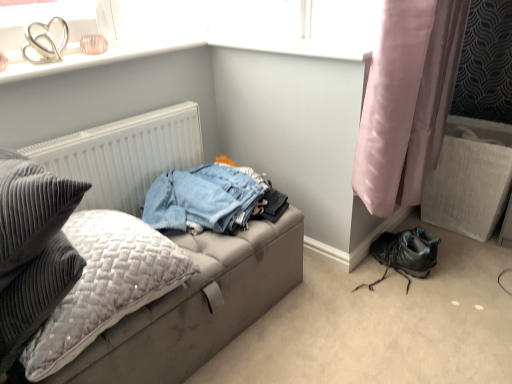
Question: From the image's perspective, is white textured radiator at upper left under pink satin curtain at lower right?

Choices:
 (A) yes
 (B) no

Answer: (A)

Question: Is white textured radiator at upper left completely or partially outside of pink satin curtain at lower right?

Choices:
 (A) yes
 (B) no

Answer: (A)

Question: Is white textured radiator at upper left behind pink satin curtain at lower right?

Choices:
 (A) no
 (B) yes

Answer: (B)

Question: Does white textured radiator at upper left appear on the right side of pink satin curtain at lower right?

Choices:
 (A) no
 (B) yes

Answer: (A)

Question: Is white textured radiator at upper left at the left side of pink satin curtain at lower right?

Choices:
 (A) no
 (B) yes

Answer: (B)

Question: Looking at their shapes, would you say white textured radiator at upper left is wider or thinner than clear glass heart at upper left?

Choices:
 (A) thin
 (B) wide

Answer: (A)

Question: Relative to clear glass heart at upper left, is white textured radiator at upper left in front or behind?

Choices:
 (A) behind
 (B) front

Answer: (A)

Question: Is white textured radiator at upper left taller or shorter than clear glass heart at upper left?

Choices:
 (A) tall
 (B) short

Answer: (A)

Question: Choose the correct answer: Is white textured radiator at upper left inside clear glass heart at upper left or outside it?

Choices:
 (A) outside
 (B) inside

Answer: (A)

Question: From the image's perspective, is velvet grey pillow at left positioned above or below white textured radiator at upper left?

Choices:
 (A) above
 (B) below

Answer: (B)

Question: In terms of size, does velvet grey pillow at left appear bigger or smaller than white textured radiator at upper left?

Choices:
 (A) big
 (B) small

Answer: (A)

Question: From a real-world perspective, is velvet grey pillow at left above or below white textured radiator at upper left?

Choices:
 (A) below
 (B) above

Answer: (A)

Question: From their relative heights in the image, would you say velvet grey pillow at left is taller or shorter than white textured radiator at upper left?

Choices:
 (A) short
 (B) tall

Answer: (A)

Question: Relative to leatherette studio couch at left, is velvet grey pillow at left in front or behind?

Choices:
 (A) behind
 (B) front

Answer: (B)

Question: Is point (44, 352) positioned closer to the camera than point (144, 367)?

Choices:
 (A) closer
 (B) farther

Answer: (A)